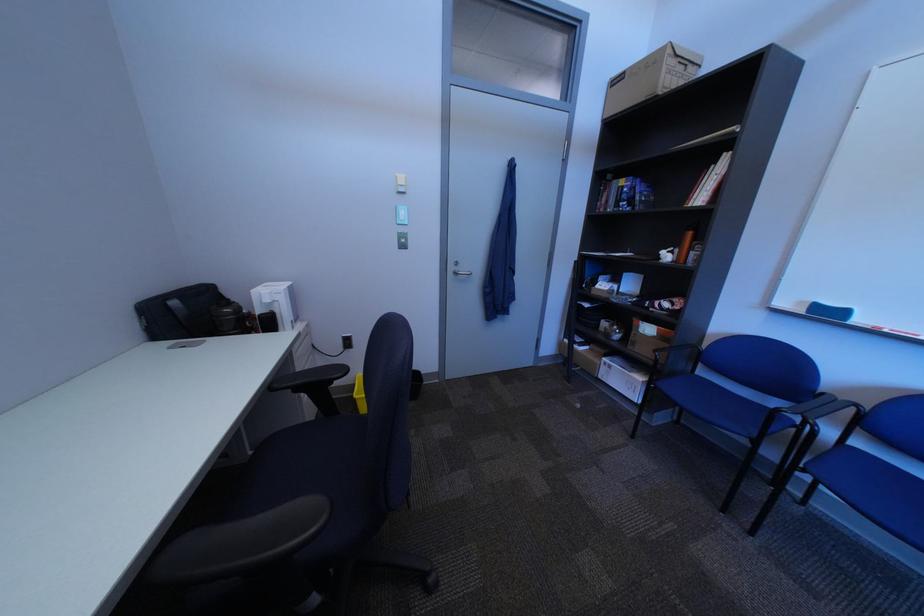
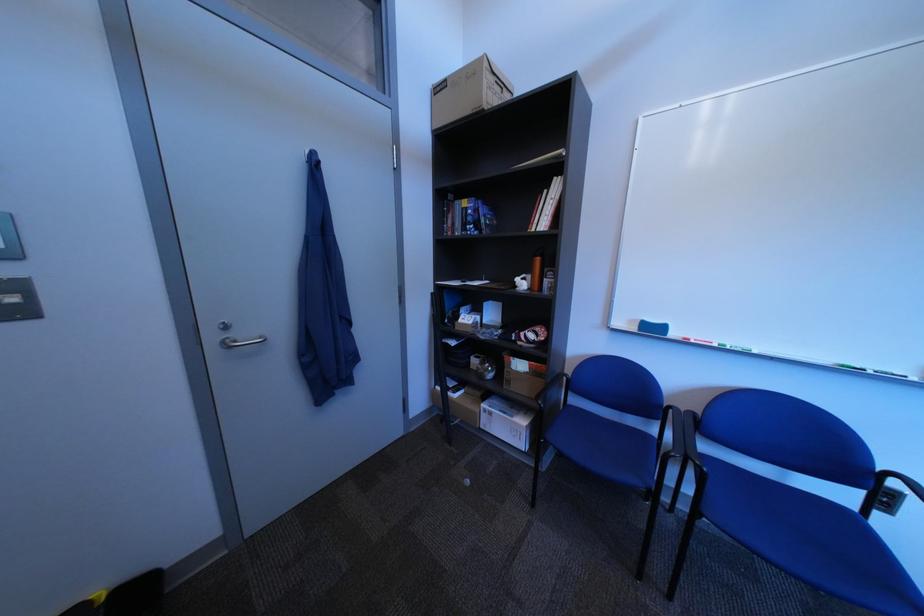
Question: I am providing you with two images of the same scene from different viewpoints. After the viewpoint changes to image2, which objects are now occluded?

Choices:
 (A) cardboard box
 (B) blue whiteboard eraser
 (C) door hook
 (D) none of these

Answer: (D)